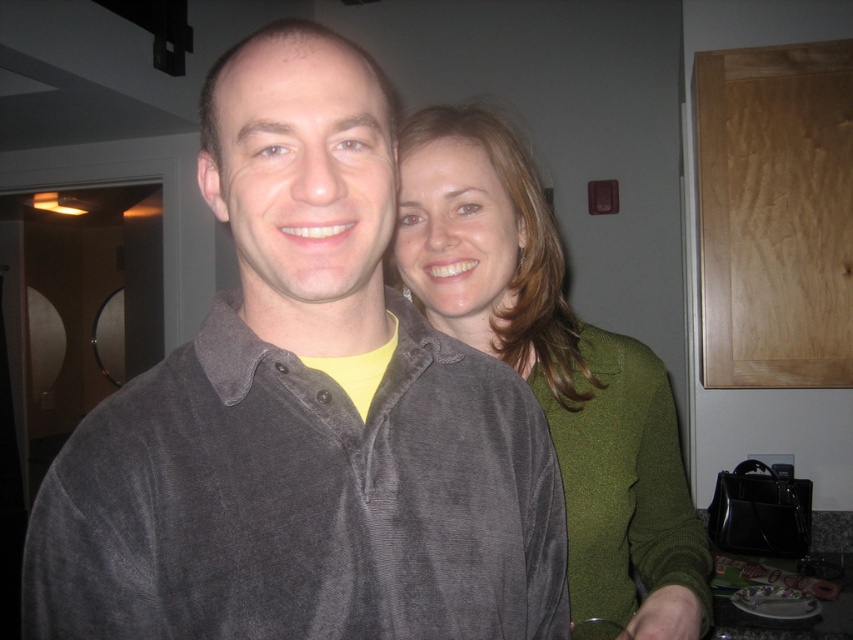
You are a photographer trying to capture a clear photo of the green velvety sweater at center. However, the velvet gray shirt at center is blocking your view. Can you adjust your position to take the photo without moving any objects?

The velvet gray shirt at center is in front of the green velvety sweater at center, so you can move your camera position slightly to the side to avoid the obstruction caused by the velvet gray shirt at center and capture the green velvety sweater at center directly.

You are a delivery person who needs to place a small package between the velvet gray shirt at center and the green velvety sweater at center. The package is 10 inches long. Can you fit it between them?

The distance between the velvet gray shirt at center and the green velvety sweater at center is 12.50 inches, so yes, the package can fit as it is shorter than the available space.

You are a fashion designer observing the scene. You need to decide the arrangement of the velvet gray shirt at center and the green velvety sweater at center for a photoshoot. Which one should be placed to the right side to match their current positions?

The green velvety sweater at center should be placed to the right side because the velvet gray shirt at center is currently to the left of it in the scene.